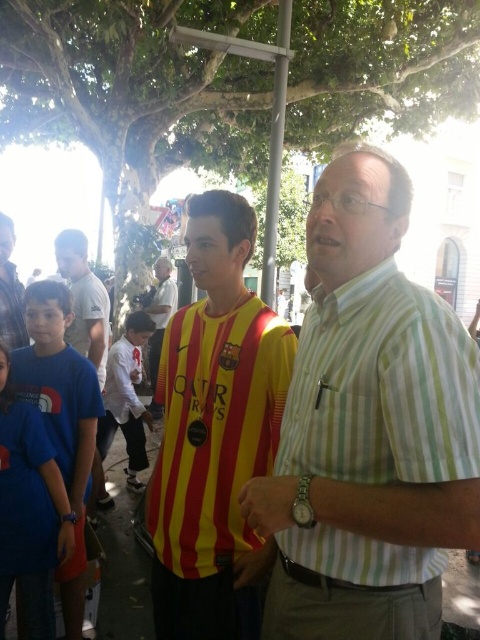
Does point (230, 531) come behind point (108, 396)?

No, it is not.

Is point (261, 573) closer to camera compared to point (107, 387)?

That is True.

In order to click on yellow/red striped jersey at center in this screenshot , I will do `click(215, 433)`.

Does green striped shirt at center appear on the left side of white fabric shirt at center?

Incorrect, green striped shirt at center is not on the left side of white fabric shirt at center.

Between point (386, 636) and point (172, 300), which one is positioned behind?

The point (172, 300) is behind.

Which is in front, point (402, 486) or point (149, 307)?

Point (402, 486) is more forward.

Image resolution: width=480 pixels, height=640 pixels. I want to click on green striped shirt at center, so click(369, 429).

Does point (20, 438) come farther from viewer compared to point (0, 250)?

No, it is in front of (0, 250).

Locate an element on the screen. The height and width of the screenshot is (640, 480). blue cotton t-shirt at lower left is located at coordinates (28, 512).

I want to click on blue cotton t-shirt at lower left, so click(x=28, y=512).